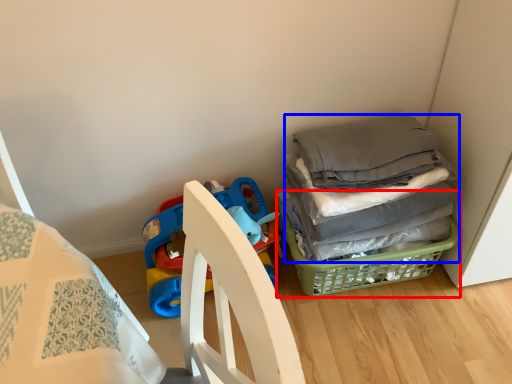
Question: Which of the following is the closest to the observer, basket (highlighted by a red box) or clothing (highlighted by a blue box)?

Choices:
 (A) basket
 (B) clothing

Answer: (B)